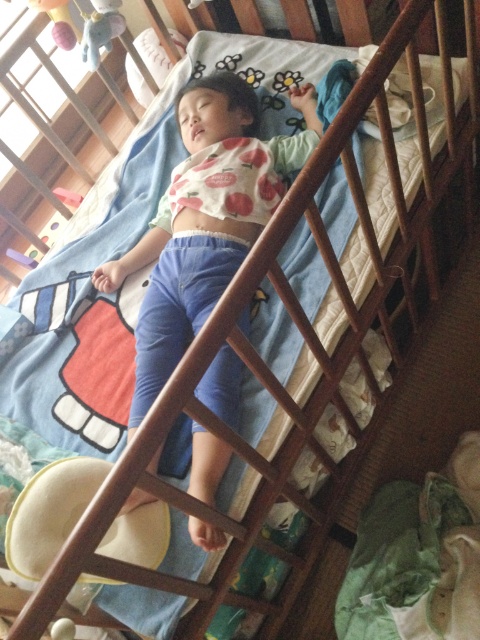
You are standing in the room and want to place a small nightlight. You have two points to choose from for placement. The first point is point (233, 141) and the second is point (96, 29). Which point is closer to you so that the nightlight will be more visible?

Point (233, 141) is further to the viewer than point (96, 29), so placing the nightlight at point (233, 141) will make it closer to you and more visible.

You are a parent checking on your child. You notice the matte white shirt at center and the soft plush elephant at upper left. Which item is closer to you based on their positions?

The matte white shirt at center is closer to you because it is in front of the soft plush elephant at upper left.